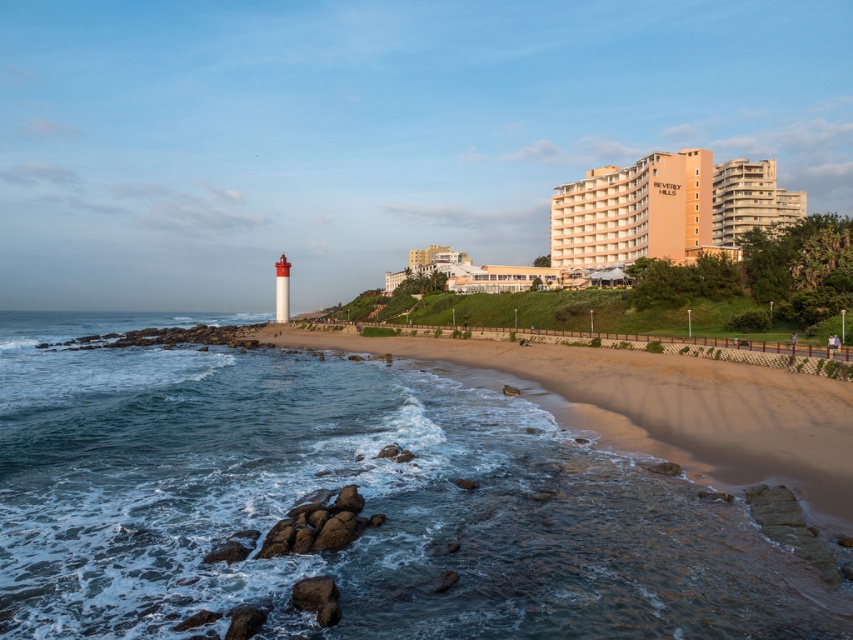
Question: Which point appears farthest from the camera in this image?

Choices:
 (A) (299, 339)
 (B) (724, 172)
 (C) (248, 392)

Answer: (B)

Question: Is clear water at beach left bigger than sandy beach at lower center?

Choices:
 (A) yes
 (B) no

Answer: (A)

Question: Which is farther from the sandy beach at lower center?

Choices:
 (A) clear water at beach left
 (B) beige concrete building at upper right

Answer: (B)

Question: Can you confirm if clear water at beach left is positioned above sandy beach at lower center?

Choices:
 (A) yes
 (B) no

Answer: (B)

Question: Which object appears closest to the camera in this image?

Choices:
 (A) clear water at beach left
 (B) sandy beach at lower center

Answer: (A)

Question: Is clear water at beach left wider than beige concrete building at upper right?

Choices:
 (A) no
 (B) yes

Answer: (A)